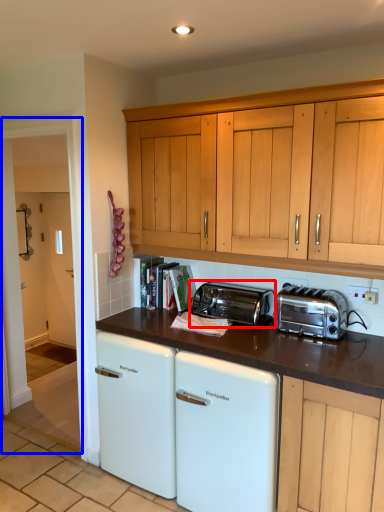
Question: Among these objects, which one is farthest to the camera, toaster (highlighted by a red box) or glass door (highlighted by a blue box)?

Choices:
 (A) toaster
 (B) glass door

Answer: (B)